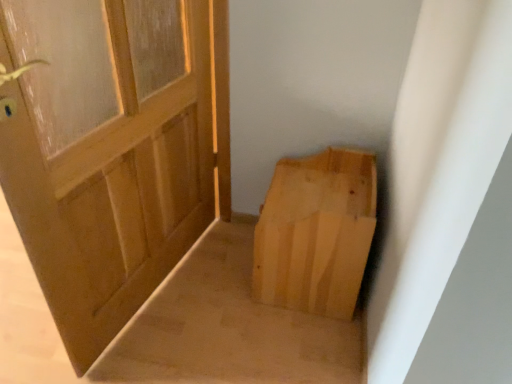
Image resolution: width=512 pixels, height=384 pixels. What are the coordinates of `vacant space positioned to the left of natural wood cardboard box at lower right` in the screenshot? It's located at (221, 279).